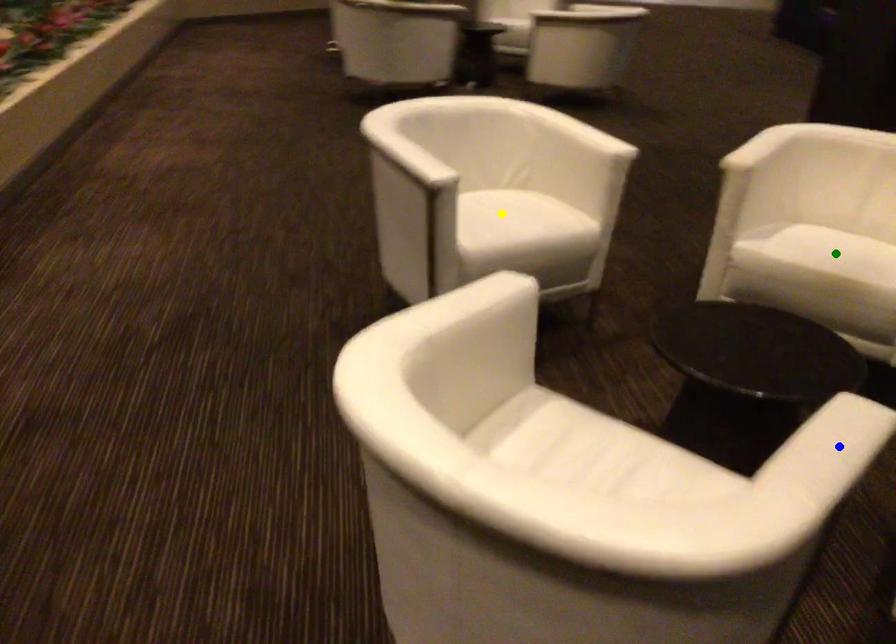
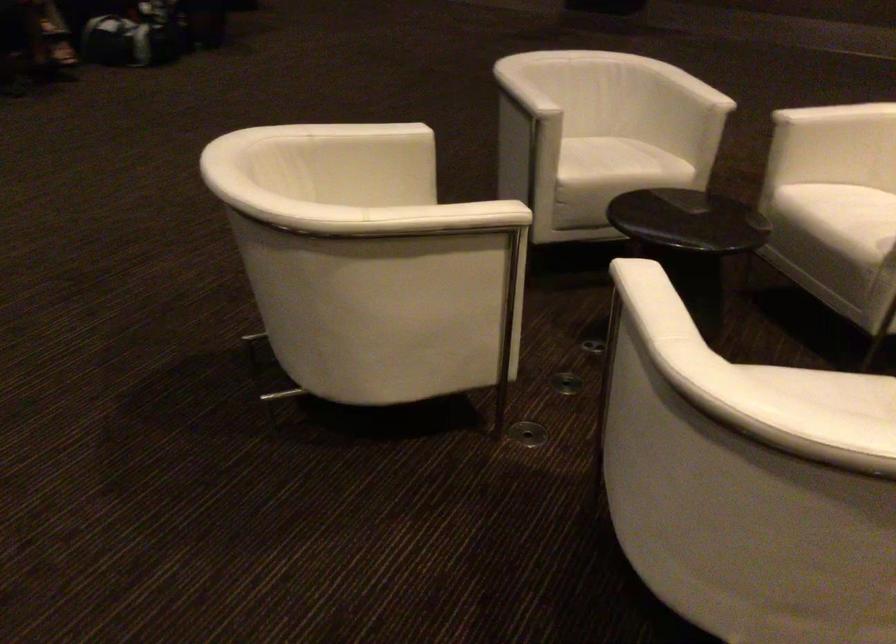
I am providing you with two images of the same scene from different viewpoints. Three points are marked in image1. Which point corresponds to a part or object that is occluded in image2?In image1, three points are marked. Which of them correspond to a part or object that is occluded in image2?Among the three points shown in image1, which one corresponds to a part or object that is no longer visible due to occlusion in image2?

green point, yellow point, blue point